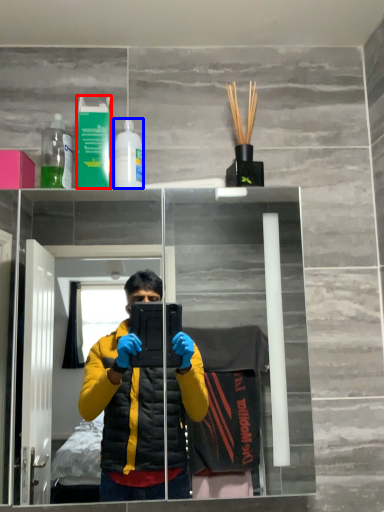
Question: Among these objects, which one is farthest to the camera, mouthwash (highlighted by a red box) or bottle (highlighted by a blue box)?

Choices:
 (A) mouthwash
 (B) bottle

Answer: (B)